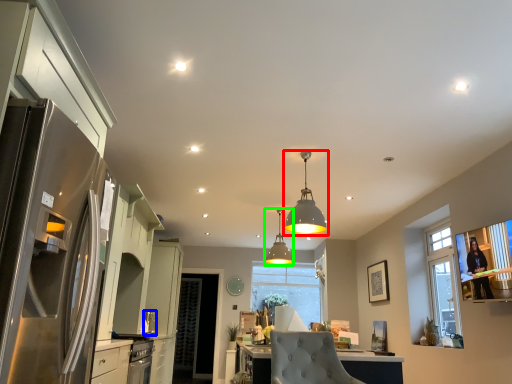
Question: Which object is positioned closest to lamp (highlighted by a red box)? Select from appliance (highlighted by a blue box) and lamp (highlighted by a green box).

Choices:
 (A) appliance
 (B) lamp

Answer: (A)